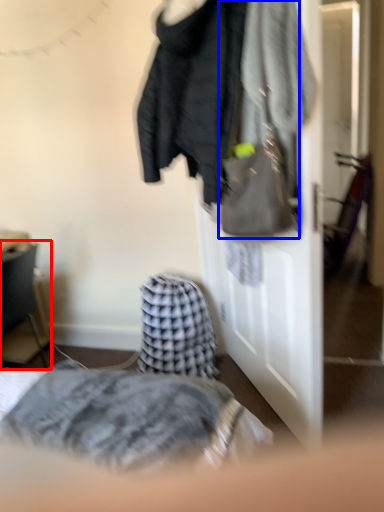
Question: Among these objects, which one is farthest to the camera, furniture (highlighted by a red box) or handbag (highlighted by a blue box)?

Choices:
 (A) furniture
 (B) handbag

Answer: (A)